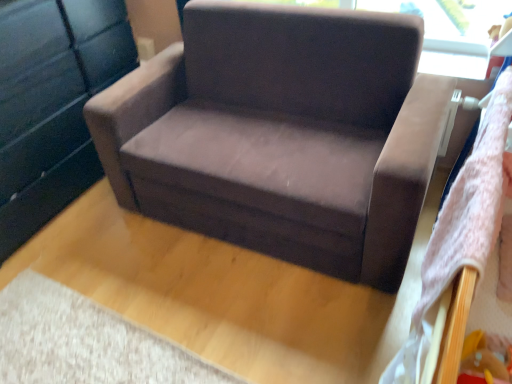
In order to click on matte black dresser at left in this screenshot , I will do `click(53, 104)`.

The width and height of the screenshot is (512, 384). Describe the element at coordinates (53, 104) in the screenshot. I see `matte black dresser at left` at that location.

In order to click on suede-like brown armchair at center in this screenshot , I will do coord(281,135).

Describe the element at coordinates (281, 135) in the screenshot. This screenshot has height=384, width=512. I see `suede-like brown armchair at center` at that location.

Identify the location of matte black dresser at left. (53, 104).

Considering the relative positions of matte black dresser at left and suede-like brown armchair at center in the image provided, is matte black dresser at left to the left of suede-like brown armchair at center from the viewer's perspective?

Yes, matte black dresser at left is to the left of suede-like brown armchair at center.

Considering the positions of objects matte black dresser at left and suede-like brown armchair at center in the image provided, who is in front, matte black dresser at left or suede-like brown armchair at center?

suede-like brown armchair at center.

Which is in front, point (110, 57) or point (177, 216)?

Point (177, 216)

From the image's perspective, which one is positioned lower, matte black dresser at left or suede-like brown armchair at center?

From the image's view, suede-like brown armchair at center is below.

From a real-world perspective, is matte black dresser at left positioned above or below suede-like brown armchair at center?

matte black dresser at left is above suede-like brown armchair at center.

Based on the photo, is matte black dresser at left wider than suede-like brown armchair at center?

No.

Considering the sizes of objects matte black dresser at left and suede-like brown armchair at center in the image provided, who is shorter, matte black dresser at left or suede-like brown armchair at center?

Standing shorter between the two is suede-like brown armchair at center.

Between matte black dresser at left and suede-like brown armchair at center, which one has smaller size?

Smaller between the two is matte black dresser at left.

Is matte black dresser at left spatially inside suede-like brown armchair at center, or outside of it?

matte black dresser at left exists outside the volume of suede-like brown armchair at center.

Are matte black dresser at left and suede-like brown armchair at center located far from each other?

No, matte black dresser at left is not far from suede-like brown armchair at center.

Could you tell me if matte black dresser at left is facing suede-like brown armchair at center?

Yes, matte black dresser at left is turned towards suede-like brown armchair at center.

What's the angular difference between matte black dresser at left and suede-like brown armchair at center's facing directions?

The facing directions of matte black dresser at left and suede-like brown armchair at center are 90.9 degrees apart.

Measure the distance from matte black dresser at left to suede-like brown armchair at center.

29.56 inches.

This screenshot has height=384, width=512. Find the location of `dresser above the suede-like brown armchair at center (from the image's perspective)`. dresser above the suede-like brown armchair at center (from the image's perspective) is located at coordinates [53, 104].

Can you confirm if suede-like brown armchair at center is positioned to the right of matte black dresser at left?

Yes, suede-like brown armchair at center is to the right of matte black dresser at left.

Is suede-like brown armchair at center positioned in front of matte black dresser at left?

Yes.

Is point (192, 147) closer or farther from the camera than point (13, 51)?

Point (192, 147) is positioned farther from the camera compared to point (13, 51).

From the image's perspective, does suede-like brown armchair at center appear lower than matte black dresser at left?

Correct, suede-like brown armchair at center appears lower than matte black dresser at left in the image.

From a real-world perspective, is suede-like brown armchair at center physically located above or below matte black dresser at left?

In terms of real-world spatial position, suede-like brown armchair at center is below matte black dresser at left.

Considering the relative sizes of suede-like brown armchair at center and matte black dresser at left in the image provided, is suede-like brown armchair at center thinner than matte black dresser at left?

No, suede-like brown armchair at center is not thinner than matte black dresser at left.

Considering the relative sizes of suede-like brown armchair at center and matte black dresser at left in the image provided, is suede-like brown armchair at center taller than matte black dresser at left?

In fact, suede-like brown armchair at center may be shorter than matte black dresser at left.

Which of these two, suede-like brown armchair at center or matte black dresser at left, is bigger?

suede-like brown armchair at center is bigger.

Is suede-like brown armchair at center spatially inside matte black dresser at left, or outside of it?

suede-like brown armchair at center is outside matte black dresser at left.

Is suede-like brown armchair at center far away from matte black dresser at left?

No, suede-like brown armchair at center is not far away from matte black dresser at left.

Is suede-like brown armchair at center facing away from matte black dresser at left?

suede-like brown armchair at center does not have its back to matte black dresser at left.

How many degrees apart are the facing directions of suede-like brown armchair at center and matte black dresser at left?

suede-like brown armchair at center and matte black dresser at left are facing 90.9 degrees away from each other.

How distant is suede-like brown armchair at center from matte black dresser at left?

suede-like brown armchair at center is 29.56 inches from matte black dresser at left.

Find the location of a particular element. chair in front of the matte black dresser at left is located at coordinates (281, 135).

At what (x,y) coordinates should I click in order to perform the action: click on chair in front of the matte black dresser at left. Please return your answer as a coordinate pair (x, y). Image resolution: width=512 pixels, height=384 pixels. Looking at the image, I should click on (281, 135).

Where is `dresser above the suede-like brown armchair at center (from the image's perspective)`? The height and width of the screenshot is (384, 512). dresser above the suede-like brown armchair at center (from the image's perspective) is located at coordinates (53, 104).